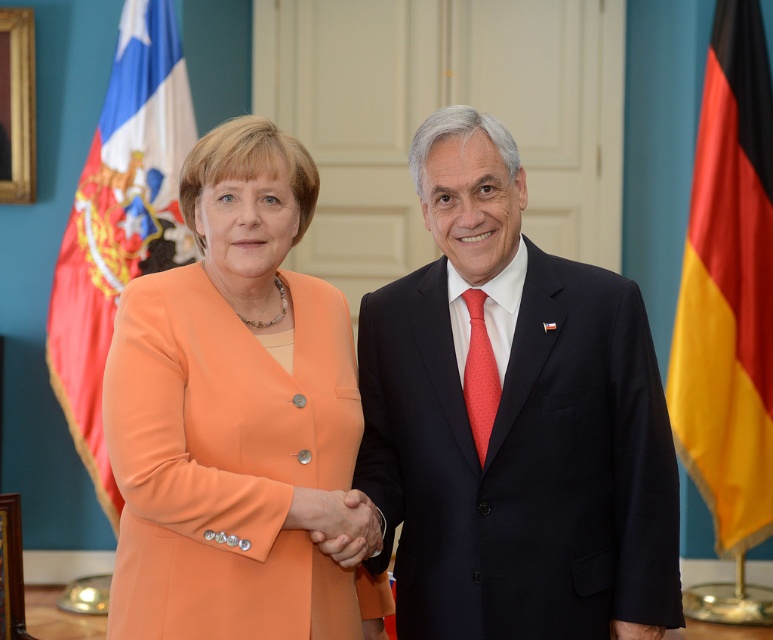
You are attending a diplomatic event and notice two flags displayed in the background. The yellow fabric flag at right and the red fabric flag at left. Which flag is located to the right of the other?

The yellow fabric flag at right is positioned on the right side of the red fabric flag at left.

You are an event photographer at a diplomatic meeting. You notice the red fabric flag at left and the smooth skin handshake at center. Which object is positioned higher in the image?

The red fabric flag at left is above the smooth skin handshake at center, so the red fabric flag at left is positioned higher in the image.

You are a photographer at a diplomatic event. You need to capture a photo where the matte black suit at center is positioned above the red fabric flag at left. Based on the current scene, is this possible without moving any objects?

The matte black suit at center is currently below the red fabric flag at left, so it is not possible to position the matte black suit at center above the red fabric flag at left without moving any objects.